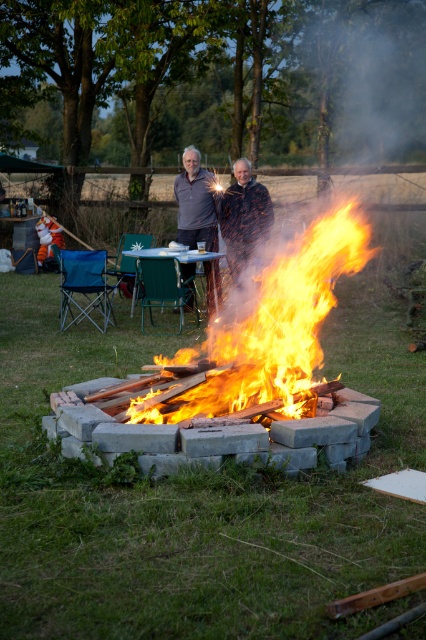
Question: Is matte black jackets at center positioned before matte gray sweater at center?

Choices:
 (A) no
 (B) yes

Answer: (A)

Question: Which of the following is the farthest from the observer?

Choices:
 (A) flaming wood at center
 (B) green plastic picnic table at center
 (C) matte gray sweater at center

Answer: (C)

Question: Which of the following is the farthest from the observer?

Choices:
 (A) (203, 180)
 (B) (195, 250)

Answer: (A)

Question: Among these points, which one is farthest from the camera?

Choices:
 (A) (195, 193)
 (B) (169, 252)
 (C) (362, 225)

Answer: (A)

Question: Can you confirm if matte black jackets at center is wider than green plastic picnic table at center?

Choices:
 (A) no
 (B) yes

Answer: (A)

Question: Does flaming wood at center appear on the left side of green plastic picnic table at center?

Choices:
 (A) no
 (B) yes

Answer: (A)